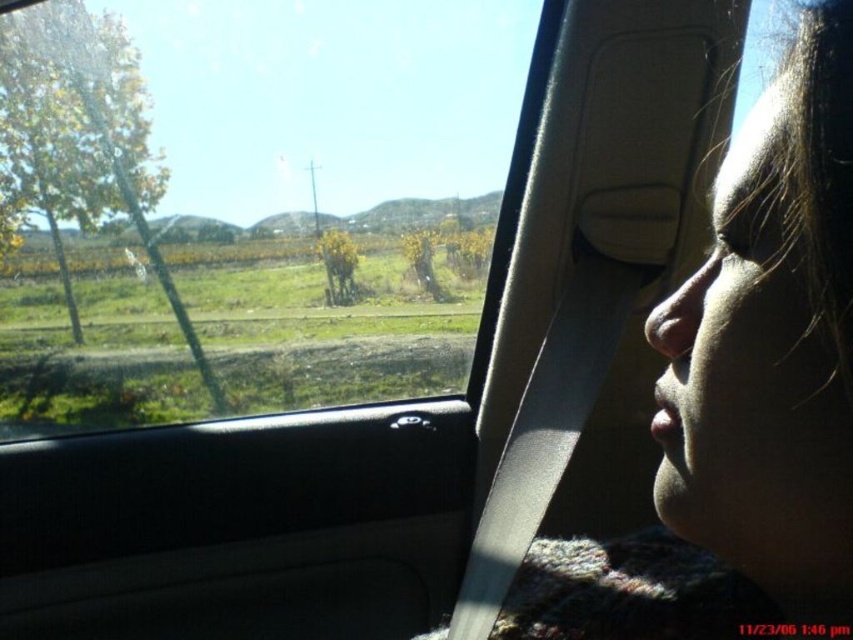
Is transparent glass car window at center above white fluffy bird at left?

Correct, transparent glass car window at center is located above white fluffy bird at left.

Image resolution: width=853 pixels, height=640 pixels. Describe the element at coordinates (247, 202) in the screenshot. I see `transparent glass car window at center` at that location.

You are a GUI agent. You are given a task and a screenshot of the screen. Output one action in this format:
    pyautogui.click(x=<x>, y=<y>)
    Task: Click on the transparent glass car window at center
    
    Given the screenshot: What is the action you would take?
    pos(247,202)

Who is taller, smooth skin face at upper right or white fluffy bird at left?

smooth skin face at upper right is taller.

Between smooth skin face at upper right and white fluffy bird at left, which one has less height?

white fluffy bird at left is shorter.

Where is `smooth skin face at upper right`? This screenshot has width=853, height=640. smooth skin face at upper right is located at coordinates (741, 397).

Between point (212, 294) and point (735, 346), which one is positioned in front?

Point (735, 346) is in front.

Between point (27, 204) and point (814, 141), which one is positioned in front?

Point (814, 141) is in front.

Image resolution: width=853 pixels, height=640 pixels. In order to click on transparent glass car window at center in this screenshot , I will do `click(247, 202)`.